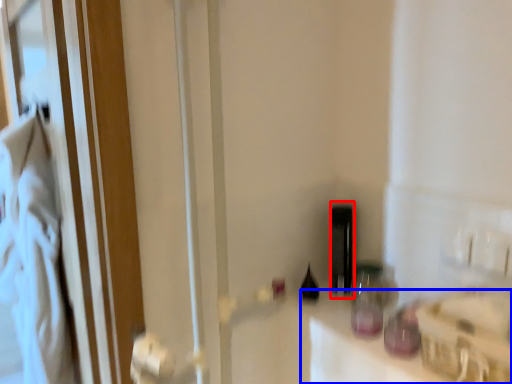
Question: Which object is closer to the camera taking this photo, bottle (highlighted by a red box) or counter top (highlighted by a blue box)?

Choices:
 (A) bottle
 (B) counter top

Answer: (B)